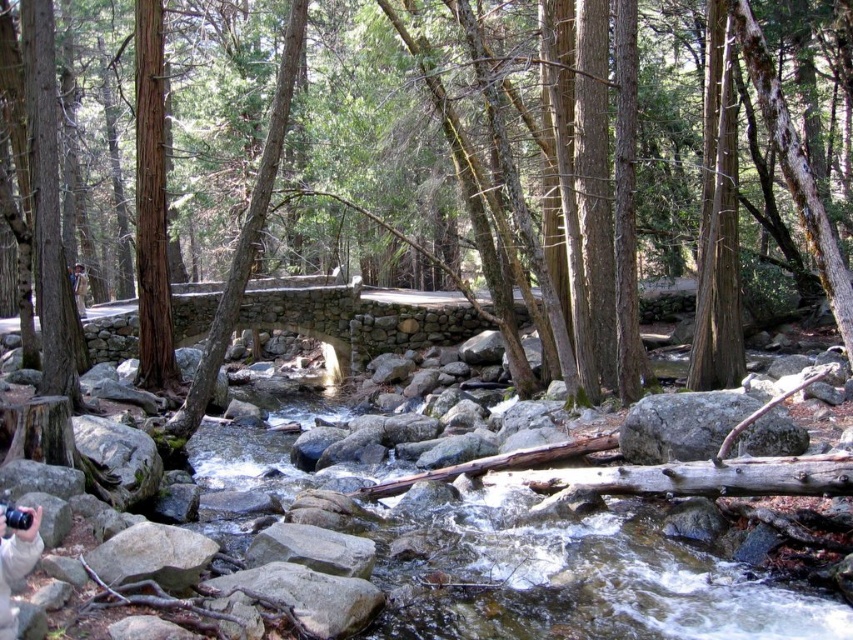
Question: Considering the relative positions of green mossy rocks at center and smooth gray rock at center in the image provided, where is green mossy rocks at center located with respect to smooth gray rock at center?

Choices:
 (A) below
 (B) above

Answer: (B)

Question: Can you confirm if green mossy rocks at center is positioned below smooth gray rock at center?

Choices:
 (A) no
 (B) yes

Answer: (A)

Question: Which point appears closest to the camera in this image?

Choices:
 (A) (569, 257)
 (B) (735, 397)

Answer: (B)

Question: Which point is farther from the camera taking this photo?

Choices:
 (A) (701, 449)
 (B) (634, 324)

Answer: (B)

Question: Is green mossy rocks at center in front of smooth gray rock at center?

Choices:
 (A) no
 (B) yes

Answer: (B)